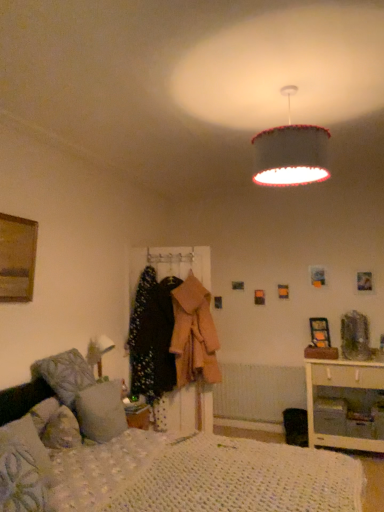
Question: From their relative heights in the image, would you say floral fabric coat at center, which is the 2th clothing in right-to-left order, is taller or shorter than wooden picture frame at right, the first picture frame in the right-to-left sequence?

Choices:
 (A) short
 (B) tall

Answer: (B)

Question: Considering their positions, is floral fabric coat at center, placed as the first clothing when sorted from left to right, located in front of or behind wooden picture frame at right, the 2th picture frame when ordered from front to back?

Choices:
 (A) behind
 (B) front

Answer: (B)

Question: Which is nearer to the textured fabric lampshade at upper center?

Choices:
 (A) fluffy white pillow at lower left, which is counted as the first pillow, starting from the front
 (B) wooden picture frame at right, the first picture frame from the bottom
 (C) floral fabric coat at center, placed as the first clothing when sorted from left to right
 (D) white knitted mattress at lower center
 (E) white wood nightstand at lower right

Answer: (D)

Question: Which of these objects is positioned farthest from the fluffy gray pillow at lower left, arranged as the second pillow when viewed from the front?

Choices:
 (A) white wood nightstand at lower right
 (B) light pink wool coat at center, which is the first clothing from right to left
 (C) fluffy white pillow at lower left, which is counted as the first pillow, starting from the front
 (D) wooden picture frame at left, placed as the 1th picture frame when sorted from front to back
 (E) white textured radiator at lower center

Answer: (E)